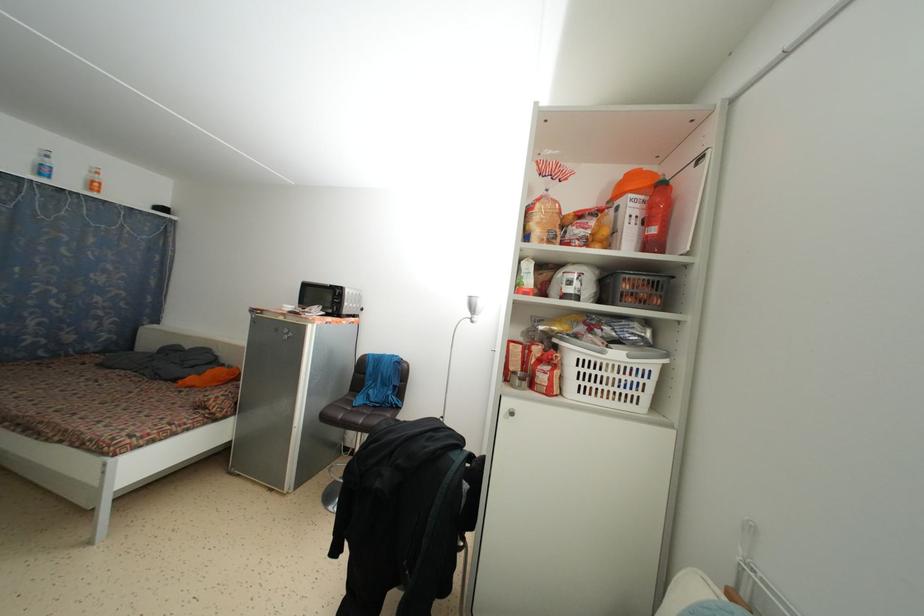
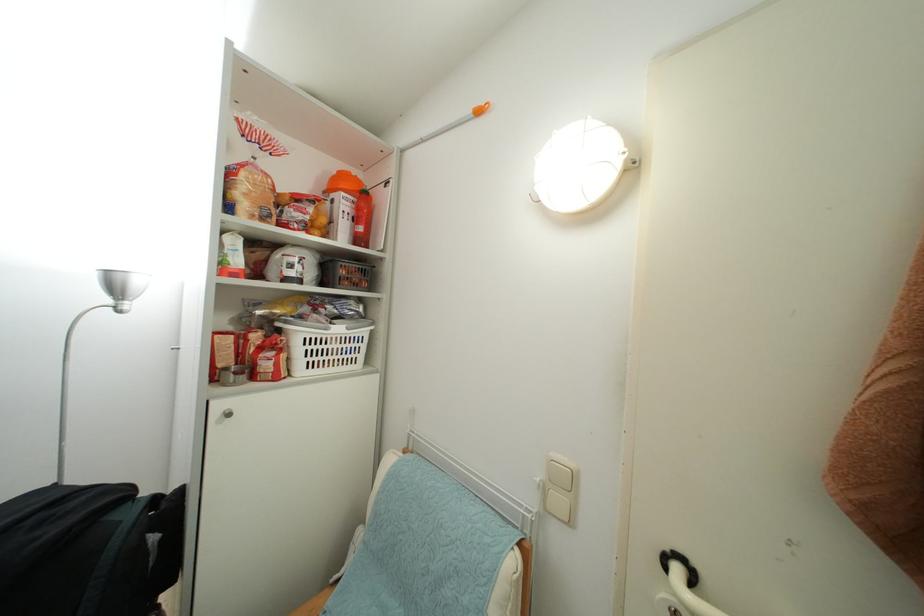
Find the pixel in the second image that matches the point at 541,206 in the first image.

(246, 171)